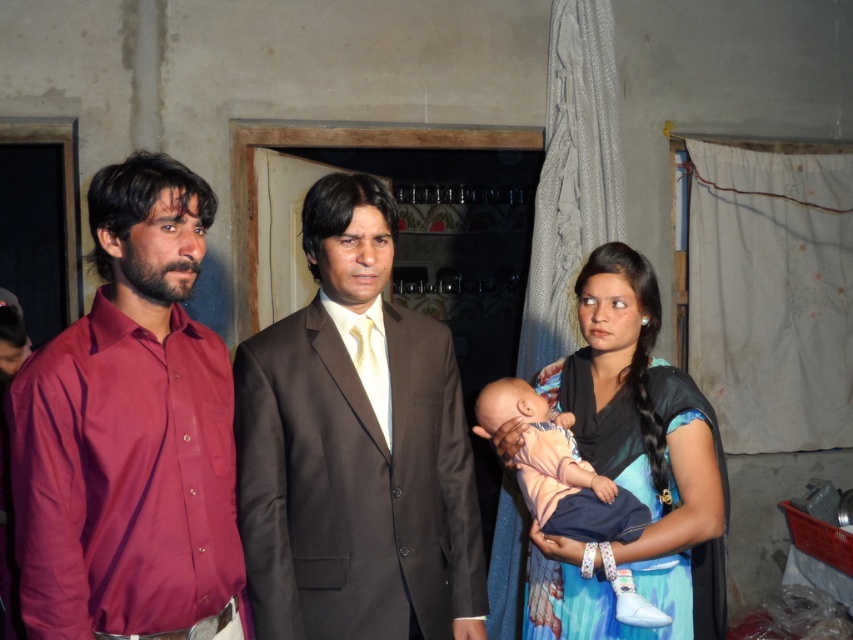
Question: Which of the following is the farthest from the observer?

Choices:
 (A) (294, 531)
 (B) (115, 256)
 (C) (97, 404)
 (D) (502, 378)

Answer: (D)

Question: Does brown suit at center appear on the left side of blue printed sari at right?

Choices:
 (A) no
 (B) yes

Answer: (B)

Question: Can you confirm if matte black suit at center is positioned above blue printed sari at right?

Choices:
 (A) no
 (B) yes

Answer: (B)

Question: Is blue printed sari at right behind soft pink fabric baby at center?

Choices:
 (A) no
 (B) yes

Answer: (B)

Question: Which object is positioned closest to the brown suit at center?

Choices:
 (A) matte burgundy shirt at left
 (B) matte black suit at center
 (C) blue printed sari at right
 (D) soft pink fabric baby at center

Answer: (B)

Question: Estimate the real-world distances between objects in this image. Which object is farther from the soft pink fabric baby at center?

Choices:
 (A) matte black suit at center
 (B) matte burgundy shirt at left
 (C) brown suit at center
 (D) blue printed sari at right

Answer: (B)